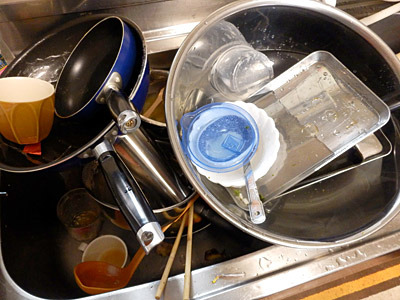
At what (x,y) coordinates should I click in order to perform the action: click on water droplets on rim of sink. Please return your answer as a coordinate pair (x, y). This screenshot has height=300, width=400. Looking at the image, I should click on (233, 268), (263, 256), (341, 257), (357, 254), (387, 240), (331, 267).